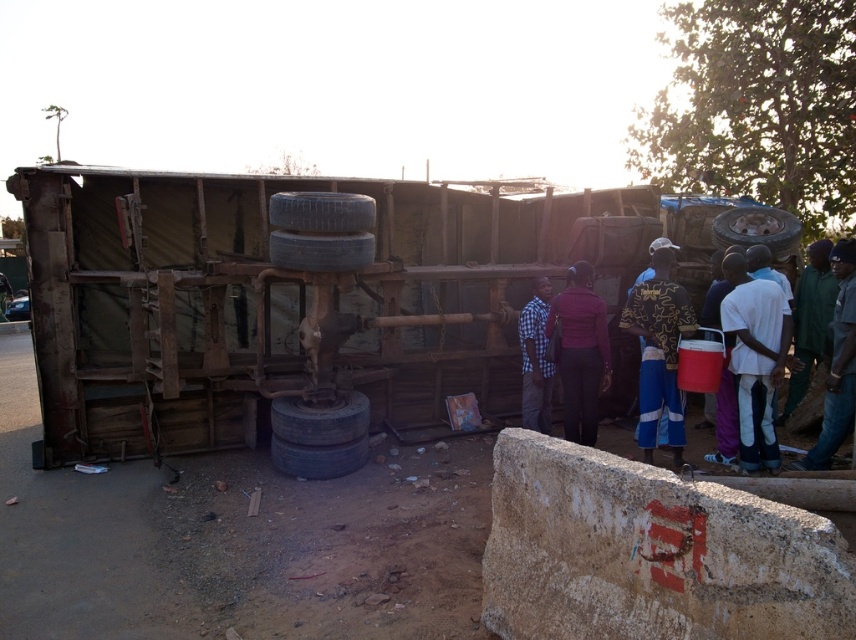
Question: In this image, where is rubber/rough tire at center located relative to blue rubber tire at center?

Choices:
 (A) right
 (B) left

Answer: (B)

Question: Estimate the real-world distances between objects in this image. Which object is farther from the blue and yellow patterned shirt at center?

Choices:
 (A) white matte shirt at center
 (B) rubber/textured tire at center

Answer: (B)

Question: Does white matte shirt at center have a larger size compared to rubber tire at center?

Choices:
 (A) yes
 (B) no

Answer: (B)

Question: Is white matte shirt at center thinner than rubber/rough tire at center?

Choices:
 (A) yes
 (B) no

Answer: (A)

Question: Among these objects, which one is nearest to the camera?

Choices:
 (A) blue and yellow patterned shirt at center
 (B) green fabric jacket at right
 (C) rubber/textured tire at center
 (D) blue rubber tire at center

Answer: (B)

Question: Which point is closer to the camera?

Choices:
 (A) (322, 248)
 (B) (755, 298)

Answer: (B)